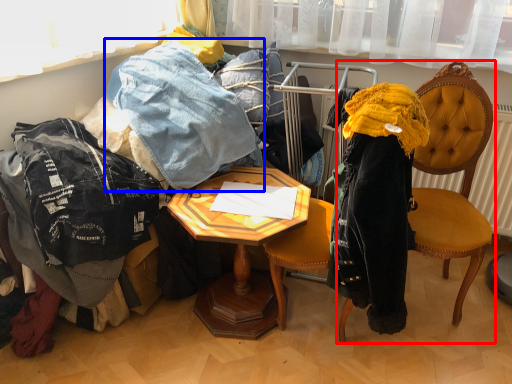
Question: Which of the following is the farthest to the observer, chair (highlighted by a red box) or trousers (highlighted by a blue box)?

Choices:
 (A) chair
 (B) trousers

Answer: (B)